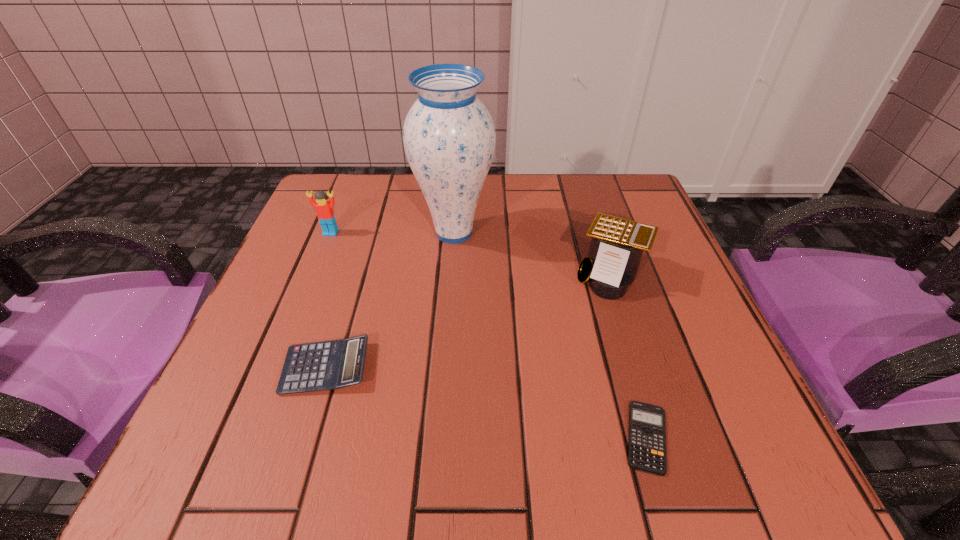
You are a GUI agent. You are given a task and a screenshot of the screen. Output one action in this format:
    pyautogui.click(x=<x>, y=<y>)
    Task: Click on the calculator object that ranks as the closest to the second nearest calculator
    This screenshot has height=540, width=960.
    Given the screenshot: What is the action you would take?
    pyautogui.click(x=647, y=440)

Identify the location of calculator that is the closest to the Lego. This screenshot has width=960, height=540. (328, 365).

At what (x,y) coordinates should I click in order to perform the action: click on vacant space that satisfies the following two spatial constraints: 1. on the back side of the second farthest calculator; 2. on the right side of the tallest calculator. Please return your answer as a coordinate pair (x, y). Image resolution: width=960 pixels, height=540 pixels. Looking at the image, I should click on (354, 275).

Locate an element on the screen. free location that satisfies the following two spatial constraints: 1. on the face of the second shortest object; 2. on the right side of the Lego is located at coordinates 276,368.

This screenshot has width=960, height=540. I want to click on free space that satisfies the following two spatial constraints: 1. on the face of the Lego; 2. on the right side of the second shortest calculator, so click(x=276, y=368).

This screenshot has width=960, height=540. In order to click on free space that satisfies the following two spatial constraints: 1. on the face of the Lego; 2. on the right side of the second shortest calculator in this screenshot , I will do `click(276, 368)`.

Image resolution: width=960 pixels, height=540 pixels. I want to click on blank area in the image that satisfies the following two spatial constraints: 1. on the back side of the tallest calculator; 2. on the right side of the leftmost calculator, so click(x=354, y=275).

This screenshot has width=960, height=540. In order to click on free space that satisfies the following two spatial constraints: 1. on the face of the Lego; 2. on the right side of the farthest calculator in this screenshot , I will do `click(314, 275)`.